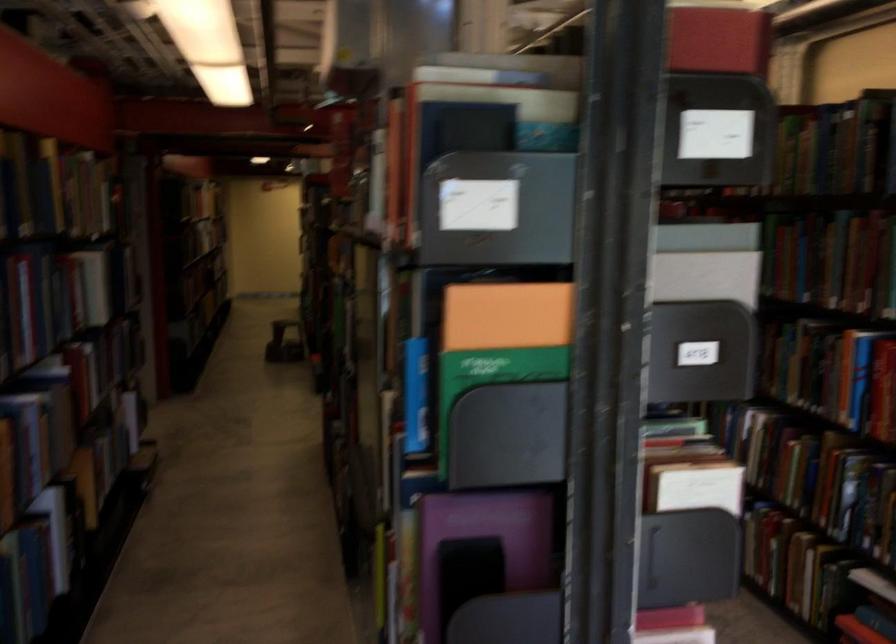
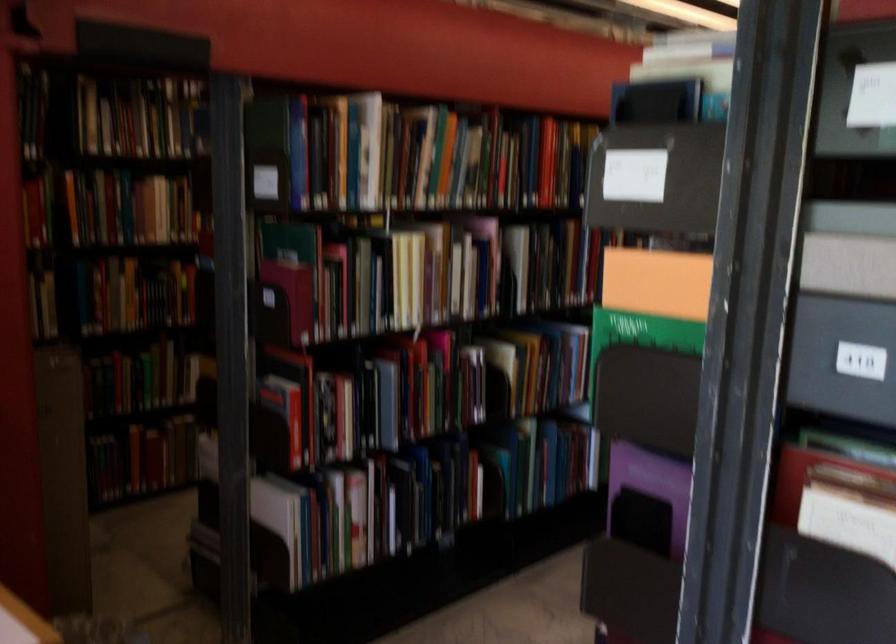
In the second image, find the point that corresponds to (478,373) in the first image.

(635, 327)